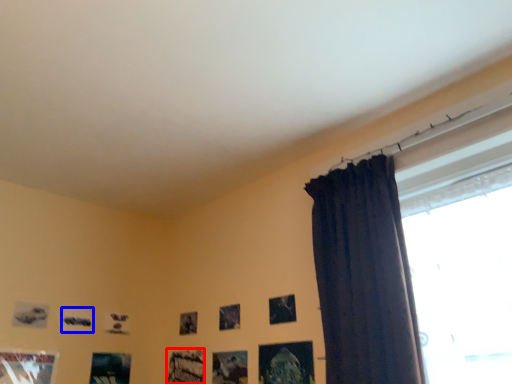
Question: Which object is further to the camera taking this photo, picture frame (highlighted by a red box) or picture frame (highlighted by a blue box)?

Choices:
 (A) picture frame
 (B) picture frame

Answer: (B)